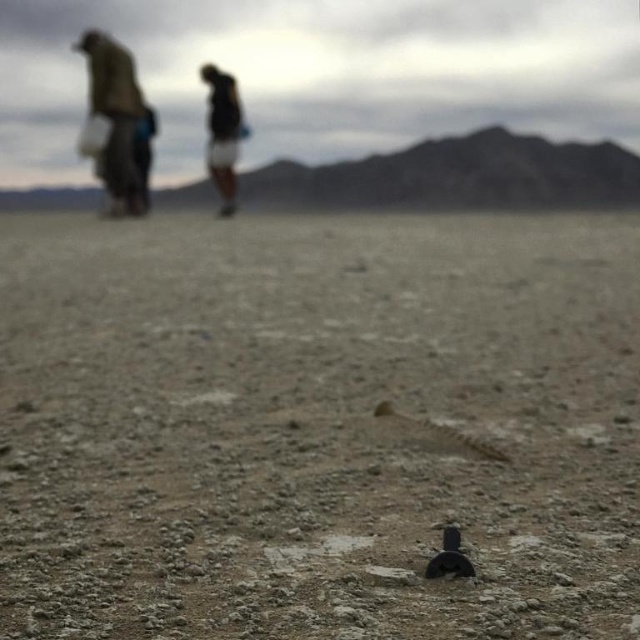
Which is below, brown fabric jacket at upper left or dark brown leather jacket at upper center?

Positioned lower is dark brown leather jacket at upper center.

Can you confirm if brown fabric jacket at upper left is positioned above dark brown leather jacket at upper center?

Yes, brown fabric jacket at upper left is above dark brown leather jacket at upper center.

I want to click on brown fabric jacket at upper left, so click(115, 120).

Can you confirm if dull brown dirt at center is taller than dark brown fabric at upper left?

No, dull brown dirt at center is not taller than dark brown fabric at upper left.

Which is behind, point (369, 554) or point (88, 44)?

Point (88, 44)

Between point (22, 323) and point (144, 116), which one is positioned behind?

Point (144, 116)

Where is `dull brown dirt at center`? Image resolution: width=640 pixels, height=640 pixels. dull brown dirt at center is located at coordinates (317, 426).

Who is taller, dull brown dirt at center or dark brown leather jacket at upper center?

Standing taller between the two is dark brown leather jacket at upper center.

Is dull brown dirt at center taller than dark brown leather jacket at upper center?

Incorrect, dull brown dirt at center's height is not larger of dark brown leather jacket at upper center's.

The image size is (640, 640). Find the location of `dull brown dirt at center`. dull brown dirt at center is located at coordinates (317, 426).